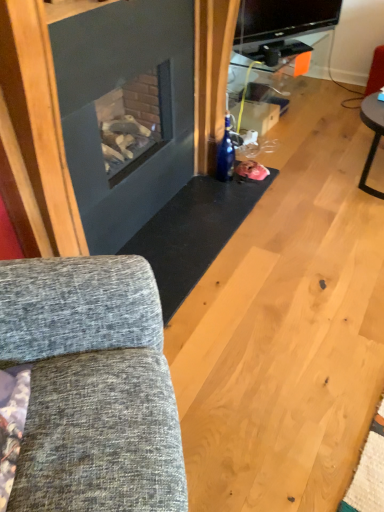
Question: Is point (11, 269) positioned closer to the camera than point (248, 95)?

Choices:
 (A) farther
 (B) closer

Answer: (B)

Question: Looking at their shapes, would you say textured gray fabric couch at left is wider or thinner than metallic silver tv stand at upper center?

Choices:
 (A) wide
 (B) thin

Answer: (A)

Question: From the image's perspective, is textured gray fabric couch at left above or below metallic silver tv stand at upper center?

Choices:
 (A) below
 (B) above

Answer: (A)

Question: From the image's perspective, relative to textured gray fabric couch at left, is metallic silver tv stand at upper center above or below?

Choices:
 (A) below
 (B) above

Answer: (B)

Question: From a real-world perspective, is metallic silver tv stand at upper center above or below textured gray fabric couch at left?

Choices:
 (A) above
 (B) below

Answer: (B)

Question: Is metallic silver tv stand at upper center spatially inside textured gray fabric couch at left, or outside of it?

Choices:
 (A) outside
 (B) inside

Answer: (A)

Question: Based on their sizes in the image, would you say metallic silver tv stand at upper center is bigger or smaller than textured gray fabric couch at left?

Choices:
 (A) small
 (B) big

Answer: (A)